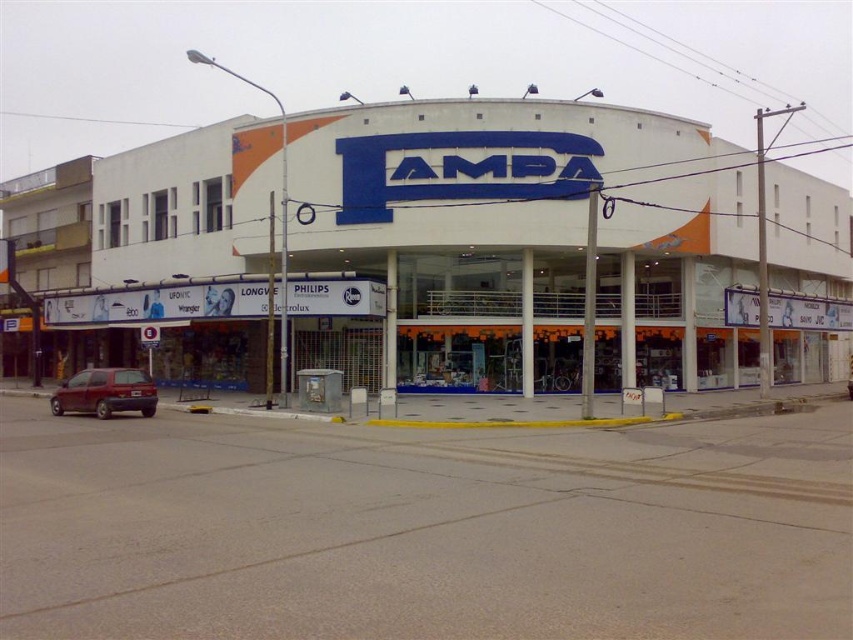
You are a delivery driver arriving at the commercial building. You need to park your maroon matte hatchback at lower left near the entrance. Is the white matte building at center blocking the parking spot?

The white matte building at center is positioned over the maroon matte hatchback at lower left, meaning the building is directly in front of the parking spot. Therefore, you cannot park there as the building itself occupies that area.

You are a photographer standing at the entrance of the commercial building. You want to take a picture of the white matte building at center and the maroon matte hatchback at lower left. Which object will appear larger in the photo?

The white matte building at center will appear larger in the photo because it is much taller than the maroon matte hatchback at lower left.